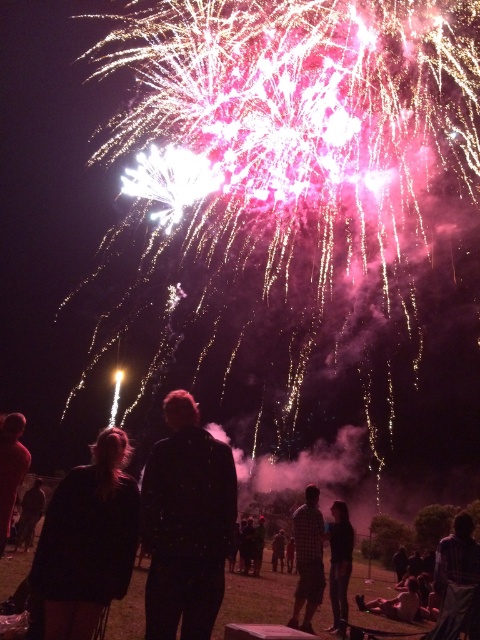
Which is above, black matte jacket at center or black matte coat at lower left?

black matte jacket at center

Does black matte jacket at center have a lesser height compared to black matte coat at lower left?

In fact, black matte jacket at center may be taller than black matte coat at lower left.

You are a GUI agent. You are given a task and a screenshot of the screen. Output one action in this format:
    pyautogui.click(x=<x>, y=<y>)
    Task: Click on the black matte jacket at center
    Image resolution: width=480 pixels, height=640 pixels.
    Given the screenshot: What is the action you would take?
    pyautogui.click(x=186, y=524)

Between point (337, 508) and point (38, 477), which one is positioned behind?

Positioned behind is point (38, 477).

Can you confirm if dark gray pants at lower right is positioned below dark hair at lower left?

Incorrect, dark gray pants at lower right is not positioned below dark hair at lower left.

Which is in front, point (330, 593) or point (19, 522)?

Point (330, 593)

You are a GUI agent. You are given a task and a screenshot of the screen. Output one action in this format:
    pyautogui.click(x=<x>, y=<y>)
    Task: Click on the dark gray pants at lower right
    The width and height of the screenshot is (480, 640).
    Given the screenshot: What is the action you would take?
    pyautogui.click(x=339, y=563)

Does black matte jacket at center have a greater height compared to dark plaid shirt at lower right?

Correct, black matte jacket at center is much taller as dark plaid shirt at lower right.

Can you confirm if black matte jacket at center is positioned to the right of dark plaid shirt at lower right?

In fact, black matte jacket at center is to the left of dark plaid shirt at lower right.

Does point (193, 576) lie behind point (464, 584)?

No, it is not.

The image size is (480, 640). Identify the location of black matte jacket at center. (186, 524).